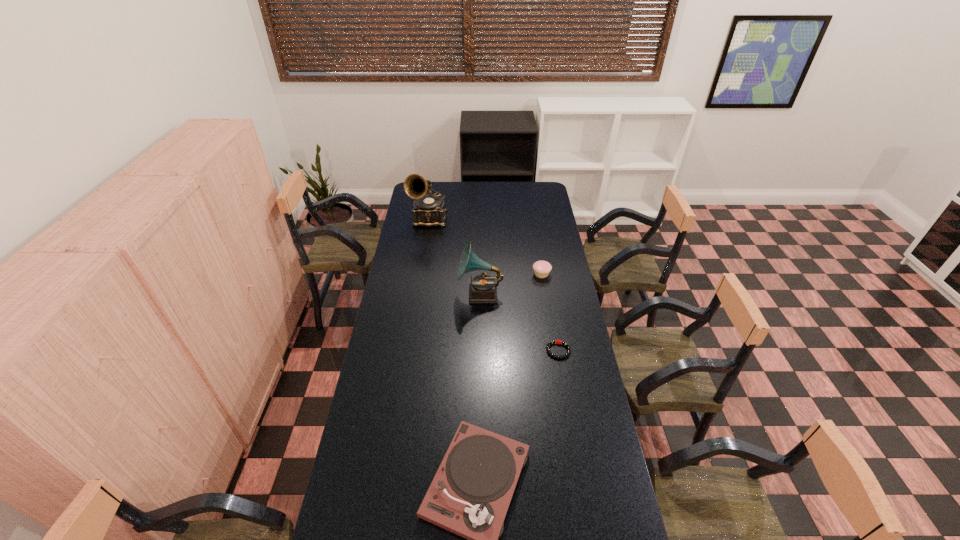
Locate an element on the screen. free region located 0.070m from the horn of the third farthest object is located at coordinates (444, 294).

Where is `vacant space located on the left of the second farthest object`? Image resolution: width=960 pixels, height=540 pixels. vacant space located on the left of the second farthest object is located at coordinates point(488,274).

You are a GUI agent. You are given a task and a screenshot of the screen. Output one action in this format:
    pyautogui.click(x=<x>, y=<y>)
    Task: Click on the free space located 0.180m on the left of the second nearest object
    This screenshot has height=540, width=960.
    Given the screenshot: What is the action you would take?
    click(502, 350)

Locate an element on the screen. The image size is (960, 540). object present at the left edge is located at coordinates (429, 209).

I want to click on cupcake that is at the right edge, so click(x=542, y=269).

Where is `bracelet that is at the right edge`? This screenshot has height=540, width=960. bracelet that is at the right edge is located at coordinates (564, 343).

In order to click on free spot at the far edge of the desktop in this screenshot , I will do `click(478, 183)`.

The height and width of the screenshot is (540, 960). In the image, there is a desktop. Identify the location of vacant area at the left edge. (369, 458).

The width and height of the screenshot is (960, 540). Find the location of `vacant space at the right edge of the desktop`. vacant space at the right edge of the desktop is located at coordinates (545, 305).

Identify the location of blank region between the second farthest object and the second nearest phonograph_record. (511, 284).